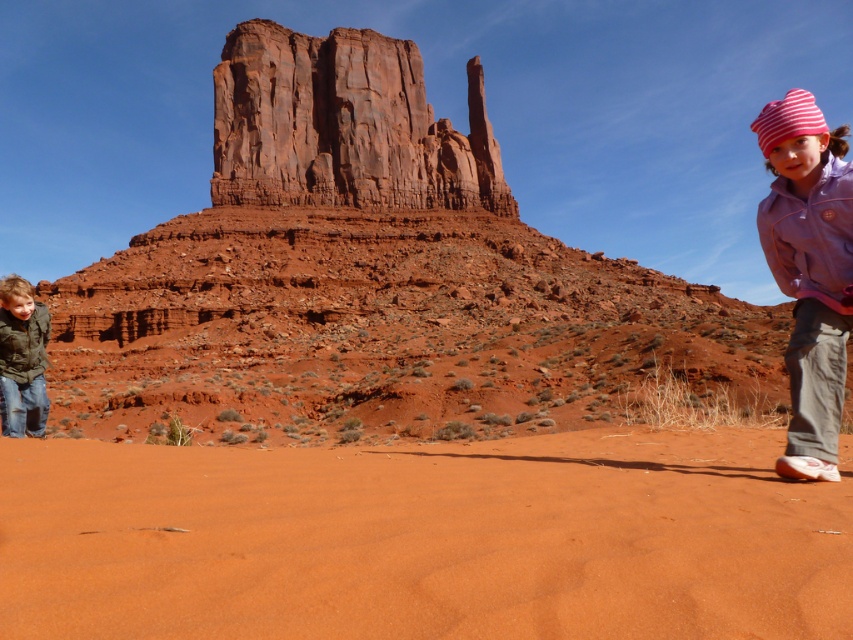
Is point (796, 220) behind point (811, 253)?

Yes, it is behind point (811, 253).

Does pink striped knit hat at upper right have a smaller size compared to purple fleece jacket at right?

No, pink striped knit hat at upper right is not smaller than purple fleece jacket at right.

Find the location of a particular element. The height and width of the screenshot is (640, 853). pink striped knit hat at upper right is located at coordinates (x=809, y=269).

Find the location of a particular element. pink striped knit hat at upper right is located at coordinates (809, 269).

Is point (480, 284) more distant than point (838, 228)?

Yes, point (480, 284) is farther from viewer.

Who is lower down, smooth sand dune at center or purple fleece jacket at right?

smooth sand dune at center

Locate an element on the screen. The height and width of the screenshot is (640, 853). smooth sand dune at center is located at coordinates (384, 326).

This screenshot has height=640, width=853. In order to click on smooth sand dune at center in this screenshot , I will do `click(384, 326)`.

Is rustic sandstone butte at center above pink striped knit hat at upper right?

Indeed, rustic sandstone butte at center is positioned over pink striped knit hat at upper right.

Which is more to the right, rustic sandstone butte at center or pink striped knit hat at upper right?

Positioned to the right is pink striped knit hat at upper right.

This screenshot has width=853, height=640. In order to click on rustic sandstone butte at center in this screenshot , I will do `click(344, 125)`.